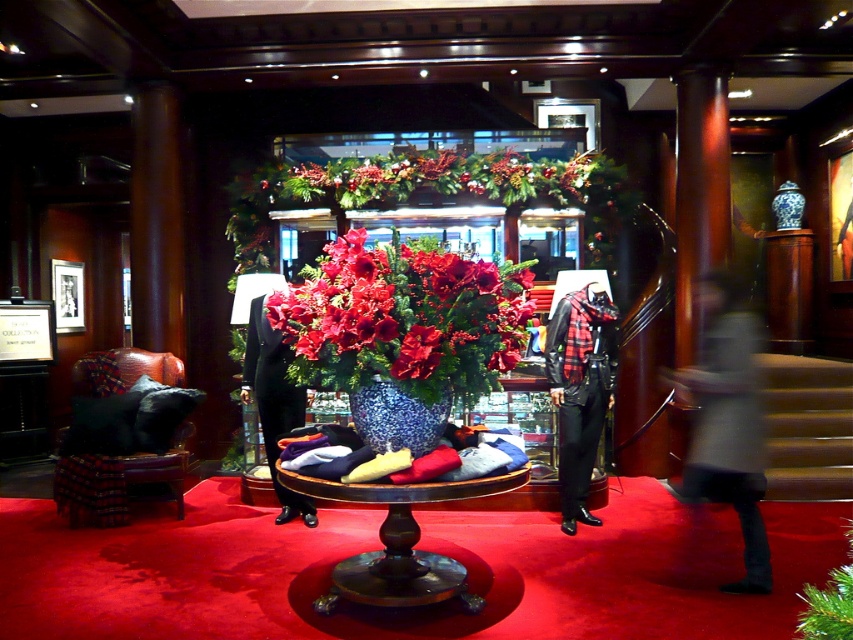
Question: Which object appears farthest from the camera in this image?

Choices:
 (A) leather armchair at lower left
 (B) glossy ceramic vase at center

Answer: (A)

Question: Which point is closer to the camera?

Choices:
 (A) (840, 461)
 (B) (386, 320)

Answer: (B)

Question: Is glossy ceramic vase at center positioned in front of wooden stairs at right?

Choices:
 (A) yes
 (B) no

Answer: (A)

Question: Can you confirm if leather armchair at lower left is positioned to the right of speckled ceramic vase at center?

Choices:
 (A) no
 (B) yes

Answer: (A)

Question: Which is farther from the leather armchair at lower left?

Choices:
 (A) speckled ceramic vase at center
 (B) glossy ceramic vase at center

Answer: (B)

Question: Where is glossy ceramic vase at center located in relation to leather armchair at lower left in the image?

Choices:
 (A) below
 (B) above

Answer: (B)